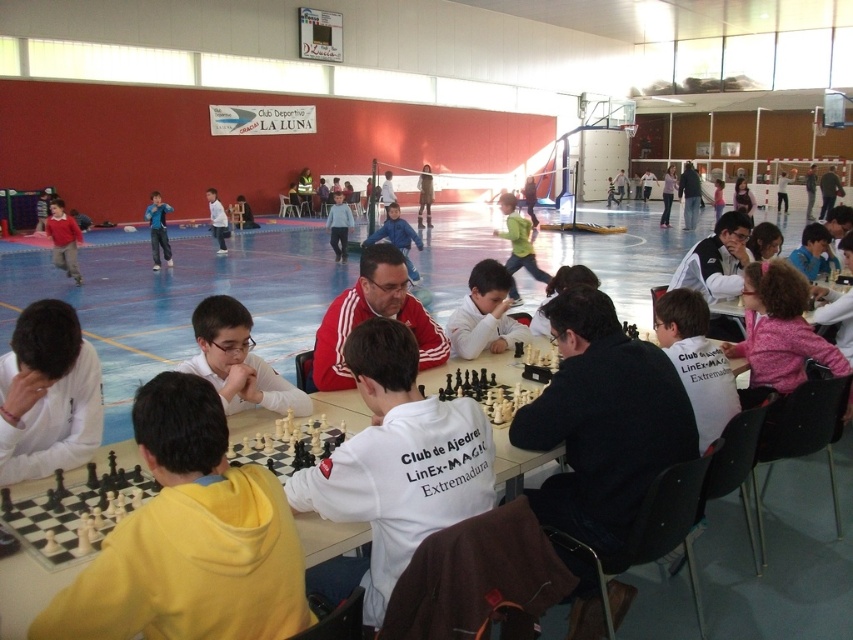
Is green matte shirt at center smaller than white cotton shirt at center?

Incorrect, green matte shirt at center is not smaller in size than white cotton shirt at center.

Is green matte shirt at center thinner than white cotton shirt at center?

Incorrect, green matte shirt at center's width is not less than white cotton shirt at center's.

Does point (514, 244) come closer to viewer compared to point (221, 214)?

That is True.

The width and height of the screenshot is (853, 640). I want to click on green matte shirt at center, so click(x=518, y=244).

Can you confirm if black sweater at center is smaller than white cotton shirt at center?

Indeed, black sweater at center has a smaller size compared to white cotton shirt at center.

Which is more to the left, black sweater at center or white cotton shirt at center?

white cotton shirt at center is more to the left.

Who is more forward, (660, 420) or (227, 220)?

Point (660, 420) is in front.

Locate an element on the screen. This screenshot has height=640, width=853. black sweater at center is located at coordinates point(602,420).

Between black sweater at center and blue fabric shirt at center, which one is positioned higher?

blue fabric shirt at center is above.

Is point (630, 346) positioned before point (337, 232)?

Yes, it is.

Where is `black sweater at center`? The image size is (853, 640). black sweater at center is located at coordinates (602, 420).